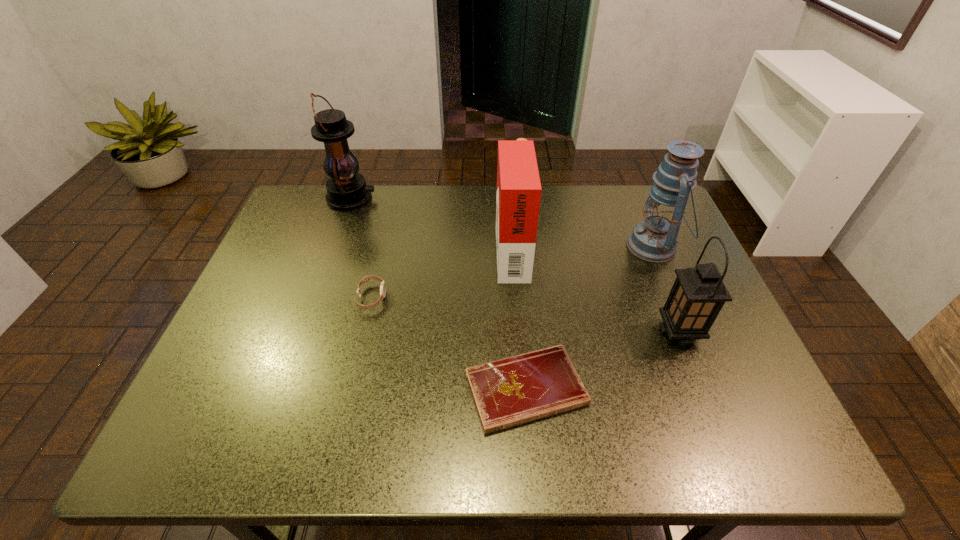
Image resolution: width=960 pixels, height=540 pixels. I want to click on free space that is in between the second object from left to right and the shortest lantern, so click(525, 315).

The image size is (960, 540). What are the coordinates of `empty space between the cigarette case and the nearest object` in the screenshot? It's located at (518, 319).

The width and height of the screenshot is (960, 540). I want to click on free space between the cigarette case and the second nearest object, so click(x=595, y=290).

Find the location of a particular element. The image size is (960, 540). vacant area that lies between the nearest object and the nearest lantern is located at coordinates (603, 361).

Locate an element on the screen. The image size is (960, 540). empty space between the second object from left to right and the fifth farthest object is located at coordinates (525, 315).

The height and width of the screenshot is (540, 960). I want to click on unoccupied position between the cigarette case and the second shortest object, so click(x=442, y=273).

Select which object is the third closest to the second nearest lantern. Please provide its 2D coordinates. Your answer should be formatted as a tuple, i.e. [(x, y)], where the tuple contains the x and y coordinates of a point satisfying the conditions above.

[(509, 392)]

You are a GUI agent. You are given a task and a screenshot of the screen. Output one action in this format:
    pyautogui.click(x=<x>, y=<y>)
    Task: Click on the object that can be found as the fifth closest to the second nearest lantern
    This screenshot has height=540, width=960.
    Given the screenshot: What is the action you would take?
    pyautogui.click(x=346, y=189)

Where is `the second closest lantern to the second farthest lantern`? Image resolution: width=960 pixels, height=540 pixels. the second closest lantern to the second farthest lantern is located at coordinates (346, 189).

This screenshot has height=540, width=960. I want to click on lantern that is the second closest to the cigarette case, so click(698, 294).